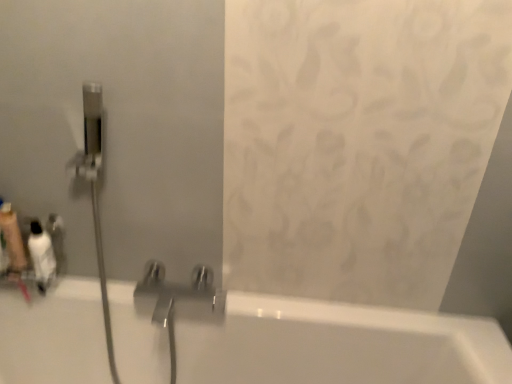
Question: Are translucent plastic soap dispenser at left, arranged as the 2th toiletry when viewed from the right, and white glossy bottle at left, the second toiletry when ordered from left to right, located far from each other?

Choices:
 (A) no
 (B) yes

Answer: (A)

Question: From a real-world perspective, is translucent plastic soap dispenser at left, arranged as the 2th toiletry when viewed from the right, positioned under white glossy bottle at left, marked as the 1th toiletry in a right-to-left arrangement, based on gravity?

Choices:
 (A) no
 (B) yes

Answer: (A)

Question: Can you confirm if translucent plastic soap dispenser at left, arranged as the 2th toiletry when viewed from the right, is shorter than white glossy bottle at left, marked as the 1th toiletry in a right-to-left arrangement?

Choices:
 (A) yes
 (B) no

Answer: (B)

Question: Considering the relative sizes of translucent plastic soap dispenser at left, arranged as the 1th toiletry when viewed from the left, and white glossy bottle at left, the second toiletry when ordered from left to right, in the image provided, is translucent plastic soap dispenser at left, arranged as the 1th toiletry when viewed from the left, wider than white glossy bottle at left, the second toiletry when ordered from left to right,?

Choices:
 (A) no
 (B) yes

Answer: (A)

Question: Is translucent plastic soap dispenser at left, arranged as the 1th toiletry when viewed from the left, smaller than white glossy bottle at left, marked as the 1th toiletry in a right-to-left arrangement?

Choices:
 (A) yes
 (B) no

Answer: (A)

Question: Considering the relative sizes of translucent plastic soap dispenser at left, arranged as the 2th toiletry when viewed from the right, and white glossy bottle at left, marked as the 1th toiletry in a right-to-left arrangement, in the image provided, is translucent plastic soap dispenser at left, arranged as the 2th toiletry when viewed from the right, taller than white glossy bottle at left, marked as the 1th toiletry in a right-to-left arrangement,?

Choices:
 (A) yes
 (B) no

Answer: (A)

Question: Can you confirm if white glossy bottle at left, marked as the 1th toiletry in a right-to-left arrangement, is smaller than translucent plastic soap dispenser at left, arranged as the 2th toiletry when viewed from the right?

Choices:
 (A) yes
 (B) no

Answer: (B)

Question: Considering the relative positions of white glossy bottle at left, marked as the 1th toiletry in a right-to-left arrangement, and translucent plastic soap dispenser at left, arranged as the 1th toiletry when viewed from the left, in the image provided, is white glossy bottle at left, marked as the 1th toiletry in a right-to-left arrangement, to the left of translucent plastic soap dispenser at left, arranged as the 1th toiletry when viewed from the left, from the viewer's perspective?

Choices:
 (A) yes
 (B) no

Answer: (B)

Question: From a real-world perspective, is white glossy bottle at left, marked as the 1th toiletry in a right-to-left arrangement, located higher than translucent plastic soap dispenser at left, arranged as the 1th toiletry when viewed from the left?

Choices:
 (A) no
 (B) yes

Answer: (A)

Question: Does white glossy bottle at left, marked as the 1th toiletry in a right-to-left arrangement, turn towards translucent plastic soap dispenser at left, arranged as the 2th toiletry when viewed from the right?

Choices:
 (A) yes
 (B) no

Answer: (B)

Question: Is white glossy bottle at left, marked as the 1th toiletry in a right-to-left arrangement, thinner than translucent plastic soap dispenser at left, arranged as the 1th toiletry when viewed from the left?

Choices:
 (A) yes
 (B) no

Answer: (B)

Question: Is white glossy bottle at left, marked as the 1th toiletry in a right-to-left arrangement, to the right of translucent plastic soap dispenser at left, arranged as the 2th toiletry when viewed from the right, from the viewer's perspective?

Choices:
 (A) no
 (B) yes

Answer: (B)

Question: Is white glossy bottle at left, the second toiletry when ordered from left to right, taller or shorter than translucent plastic soap dispenser at left, arranged as the 2th toiletry when viewed from the right?

Choices:
 (A) short
 (B) tall

Answer: (A)